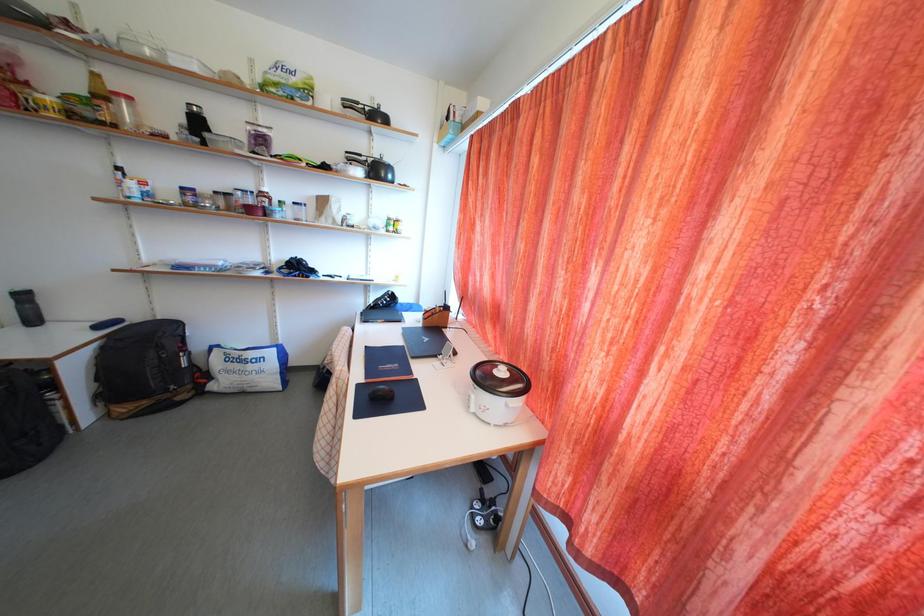
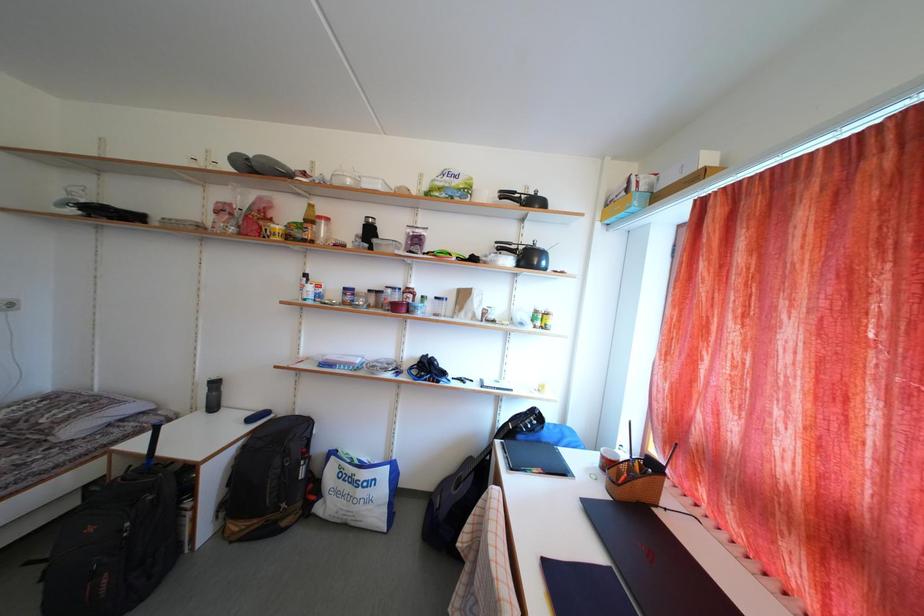
What movement of the cameraman would produce the second image?

The cameraman moved toward left, forward.